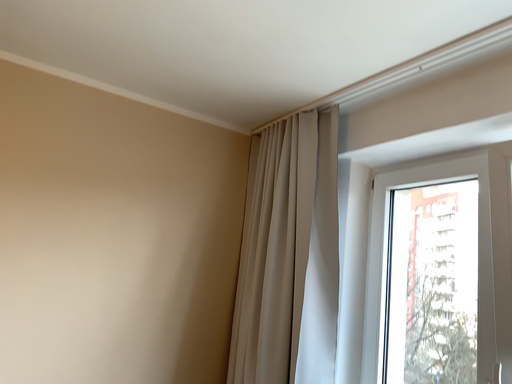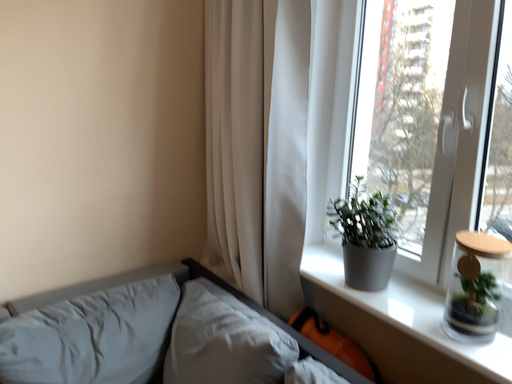
Question: Which way did the camera rotate in the video?

Choices:
 (A) rotated downward
 (B) rotated upward

Answer: (A)